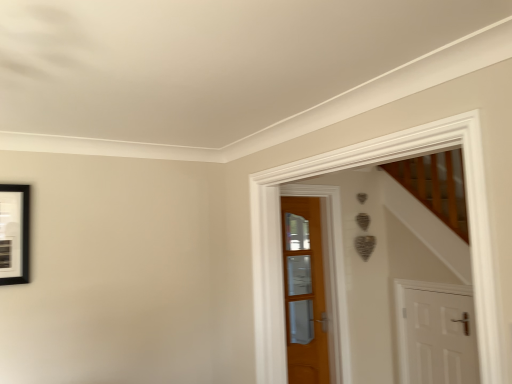
Question: Is white matte door at lower right, positioned as the 1th door in right-to-left order, in front of or behind wooden door at center, which ranks as the 2th door in right-to-left order, in the image?

Choices:
 (A) behind
 (B) front

Answer: (B)

Question: Is white matte door at lower right, positioned as the 1th door in right-to-left order, to the left or to the right of wooden door at center, which ranks as the 2th door in right-to-left order, in the image?

Choices:
 (A) left
 (B) right

Answer: (B)

Question: Considering the positions of white matte door at lower right, acting as the second door starting from the left, and wooden door at center, arranged as the 1th door when viewed from the left, in the image, is white matte door at lower right, acting as the second door starting from the left, bigger or smaller than wooden door at center, arranged as the 1th door when viewed from the left,?

Choices:
 (A) small
 (B) big

Answer: (B)

Question: Considering the positions of wooden door at center, which ranks as the 2th door in right-to-left order, and white matte door at lower right, acting as the second door starting from the left, in the image, is wooden door at center, which ranks as the 2th door in right-to-left order, bigger or smaller than white matte door at lower right, acting as the second door starting from the left,?

Choices:
 (A) big
 (B) small

Answer: (B)

Question: Based on their positions, is wooden door at center, which ranks as the 2th door in right-to-left order, located to the left or right of white matte door at lower right, positioned as the 1th door in right-to-left order?

Choices:
 (A) right
 (B) left

Answer: (B)

Question: Relative to white matte door at lower right, positioned as the 1th door in right-to-left order, is wooden door at center, arranged as the 1th door when viewed from the left, in front or behind?

Choices:
 (A) front
 (B) behind

Answer: (B)

Question: From a real-world perspective, is wooden door at center, which ranks as the 2th door in right-to-left order, physically located above or below white matte door at lower right, acting as the second door starting from the left?

Choices:
 (A) below
 (B) above

Answer: (B)